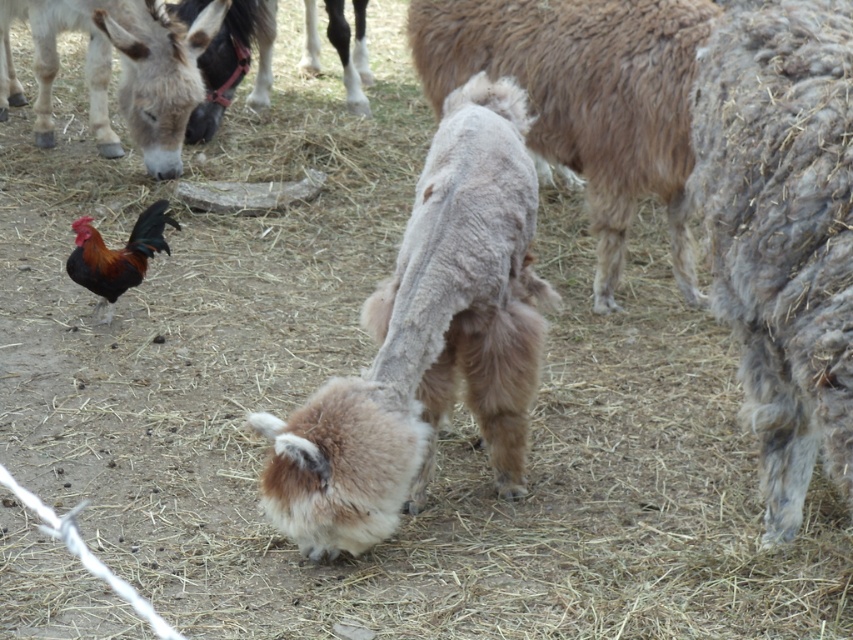
Does point (676, 113) come farther from viewer compared to point (86, 256)?

Yes, point (676, 113) is farther from viewer.

In the scene shown: Is fluffy brown sheep at center wider than shiny brown rooster at upper left?

Indeed, fluffy brown sheep at center has a greater width compared to shiny brown rooster at upper left.

Is point (595, 92) in front of point (90, 241)?

No, (595, 92) is further to viewer.

You are a GUI agent. You are given a task and a screenshot of the screen. Output one action in this format:
    pyautogui.click(x=<x>, y=<y>)
    Task: Click on the fluffy brown sheep at center
    
    Given the screenshot: What is the action you would take?
    pyautogui.click(x=585, y=99)

Find the location of a particular element. fluffy beige goat at center is located at coordinates pyautogui.click(x=425, y=340).

Who is positioned more to the right, fluffy beige goat at center or gray woolen sheep at center?

Positioned to the right is gray woolen sheep at center.

What do you see at coordinates (425, 340) in the screenshot?
I see `fluffy beige goat at center` at bounding box center [425, 340].

Where is `fluffy beige goat at center`? The height and width of the screenshot is (640, 853). fluffy beige goat at center is located at coordinates (425, 340).

Who is positioned more to the left, fluffy beige goat at center or shiny brown rooster at upper left?

Positioned to the left is shiny brown rooster at upper left.

Is fluffy beige goat at center smaller than shiny brown rooster at upper left?

Actually, fluffy beige goat at center might be larger than shiny brown rooster at upper left.

Describe the element at coordinates (425, 340) in the screenshot. I see `fluffy beige goat at center` at that location.

Image resolution: width=853 pixels, height=640 pixels. What are the coordinates of `fluffy beige goat at center` in the screenshot? It's located at [425, 340].